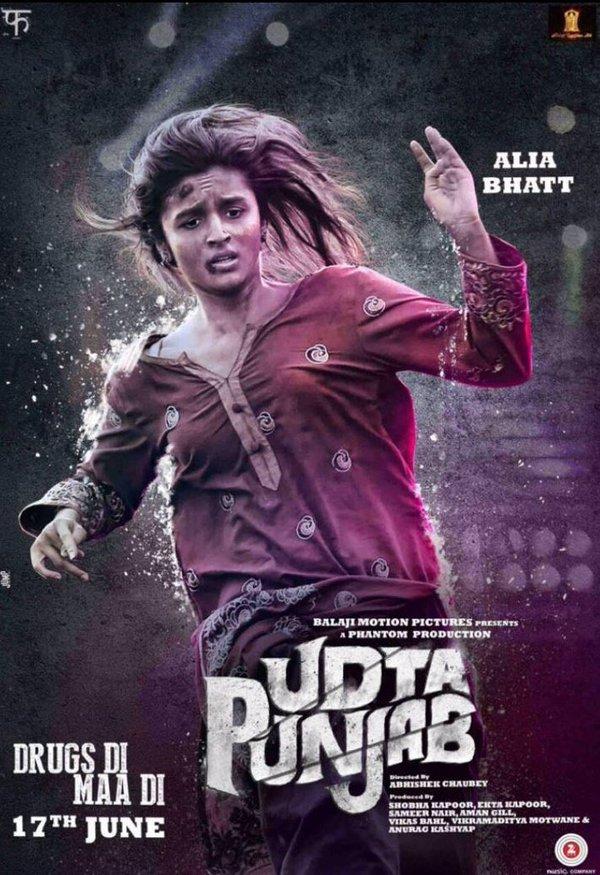
You are a GUI agent. You are given a task and a screenshot of the screen. Output one action in this format:
    pyautogui.click(x=<x>, y=<y>)
    Task: Click on the movie poster
    The image size is (600, 875).
    Given the screenshot: What is the action you would take?
    pyautogui.click(x=509, y=442)